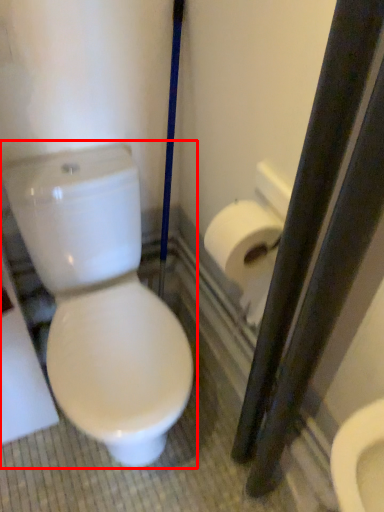
Question: From the image, what is the correct spatial relationship of toilet (annotated by the red box) in relation to toilet paper?

Choices:
 (A) right
 (B) left

Answer: (B)